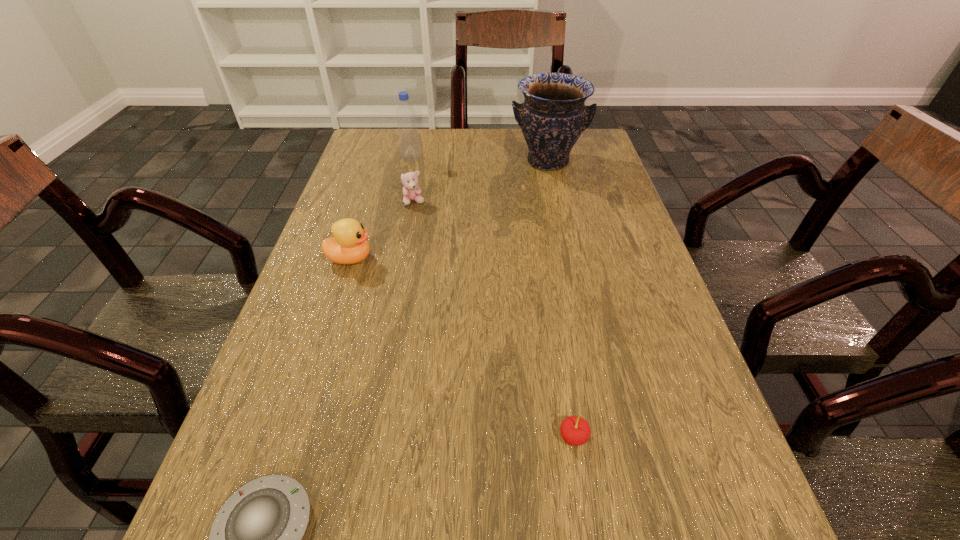
Identify the location of blank space located 0.190m on the back of the cherry. This screenshot has width=960, height=540. (557, 329).

The image size is (960, 540). In order to click on pottery that is at the far edge in this screenshot , I will do `click(553, 116)`.

Image resolution: width=960 pixels, height=540 pixels. I want to click on bottle located in the far edge section of the desktop, so click(408, 137).

Image resolution: width=960 pixels, height=540 pixels. Identify the location of bottle that is at the left edge. (408, 137).

This screenshot has width=960, height=540. I want to click on duckling located in the left edge section of the desktop, so click(x=348, y=246).

Image resolution: width=960 pixels, height=540 pixels. What are the coordinates of `object present at the right edge` in the screenshot? It's located at coord(553,116).

This screenshot has width=960, height=540. I want to click on object that is at the far left corner, so click(408, 137).

Find the location of a particular element. Image resolution: width=960 pixels, height=540 pixels. object located at the far right corner is located at coordinates (553, 116).

Locate an element on the screen. Image resolution: width=960 pixels, height=540 pixels. free space at the far edge of the desktop is located at coordinates (510, 167).

The height and width of the screenshot is (540, 960). Identify the location of vacant region at the left edge of the desktop. (324, 226).